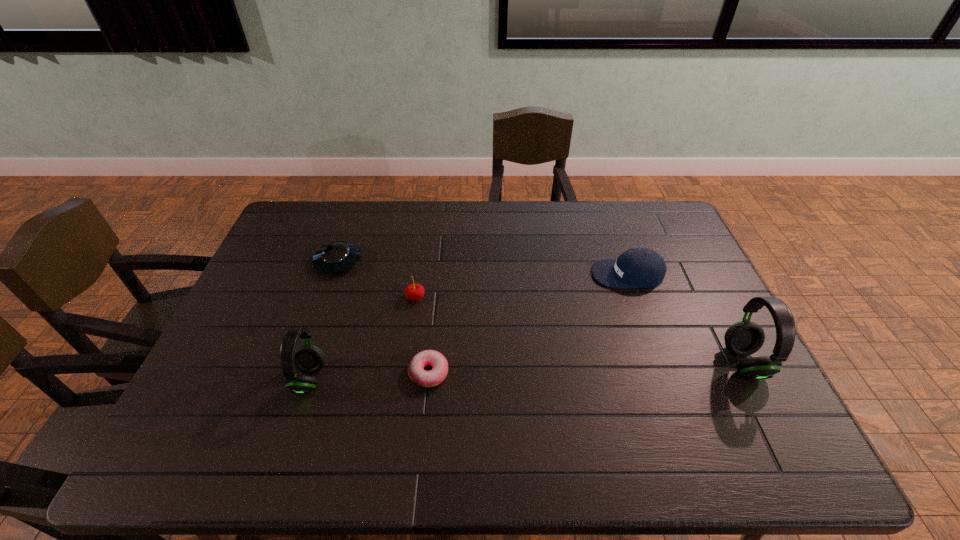
This screenshot has width=960, height=540. I want to click on object that stands as the second closest to the doughnut, so click(x=309, y=359).

Locate which object is the fifth closest to the baseball cap. Please provide its 2D coordinates. Your answer should be formatted as a tuple, i.e. [(x, y)], where the tuple contains the x and y coordinates of a point satisfying the conditions above.

[(309, 359)]

Locate an element on the screen. The image size is (960, 540). free point that satisfies the following two spatial constraints: 1. on the front-facing side of the baseball cap; 2. on the front side of the cherry is located at coordinates (636, 298).

Find the location of a particular element. blank space that satisfies the following two spatial constraints: 1. on the front side of the cherry; 2. on the left side of the shortest object is located at coordinates (405, 373).

Locate an element on the screen. Image resolution: width=960 pixels, height=540 pixels. free space that satisfies the following two spatial constraints: 1. on the front-facing side of the baseball cap; 2. on the front side of the doughnut is located at coordinates (661, 373).